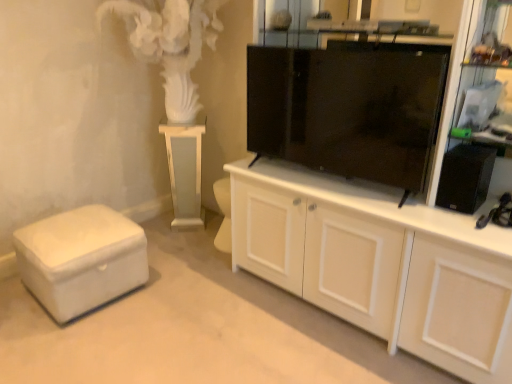
Question: From the image's perspective, is white leather ottoman at lower left under black plastic speaker at right?

Choices:
 (A) no
 (B) yes

Answer: (B)

Question: Does white leather ottoman at lower left turn towards black plastic speaker at right?

Choices:
 (A) yes
 (B) no

Answer: (B)

Question: Considering the relative positions of white leather ottoman at lower left and black plastic speaker at right in the image provided, is white leather ottoman at lower left to the left of black plastic speaker at right from the viewer's perspective?

Choices:
 (A) no
 (B) yes

Answer: (B)

Question: Would you say black plastic speaker at right is part of white leather ottoman at lower left's contents?

Choices:
 (A) no
 (B) yes

Answer: (A)

Question: From a real-world perspective, is white leather ottoman at lower left physically below black plastic speaker at right?

Choices:
 (A) no
 (B) yes

Answer: (B)

Question: Is white leather ottoman at lower left further to the viewer compared to black plastic speaker at right?

Choices:
 (A) no
 (B) yes

Answer: (B)

Question: From a real-world perspective, is black glossy tv cabinet at center physically below white glossy pedestal at center?

Choices:
 (A) no
 (B) yes

Answer: (A)

Question: Does black glossy tv cabinet at center have a lesser height compared to white glossy pedestal at center?

Choices:
 (A) no
 (B) yes

Answer: (B)

Question: Considering the relative sizes of black glossy tv cabinet at center and white glossy pedestal at center in the image provided, is black glossy tv cabinet at center thinner than white glossy pedestal at center?

Choices:
 (A) no
 (B) yes

Answer: (B)

Question: Would you say black glossy tv cabinet at center is outside white glossy pedestal at center?

Choices:
 (A) yes
 (B) no

Answer: (A)

Question: Is black glossy tv cabinet at center in front of white glossy pedestal at center?

Choices:
 (A) yes
 (B) no

Answer: (A)

Question: From the image's perspective, does black glossy tv cabinet at center appear higher than white glossy pedestal at center?

Choices:
 (A) no
 (B) yes

Answer: (B)

Question: Is white glossy pedestal at center at the back of white wood cabinet at center?

Choices:
 (A) no
 (B) yes

Answer: (A)